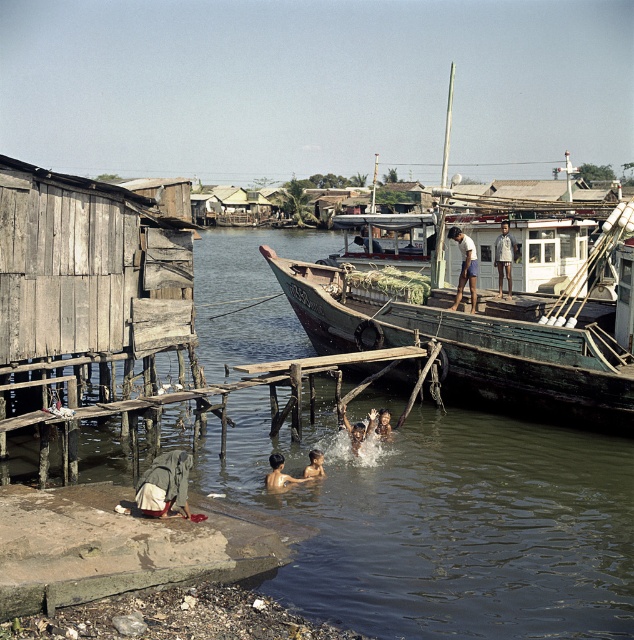
You are a photographer standing on the concrete platform at the riverside. You notice two children with light brown skin at lower center and light brown skin at water center. Which child is closer to your left side?

The light brown skin at lower center is positioned on the left side of light brown skin at water center, so the child with light brown skin at lower center is closer to your left side.

You are a photographer trying to capture the children playing in the river. You notice the light brown skin at lower center in the image. Based on its 2D coordinates, where would you position your camera to ensure this area is centered in your shot?

To center the light brown skin at lower center, position your camera so that the coordinates align with the center of your viewfinder at point 0.744 on the x and 0.442 on the y axis.